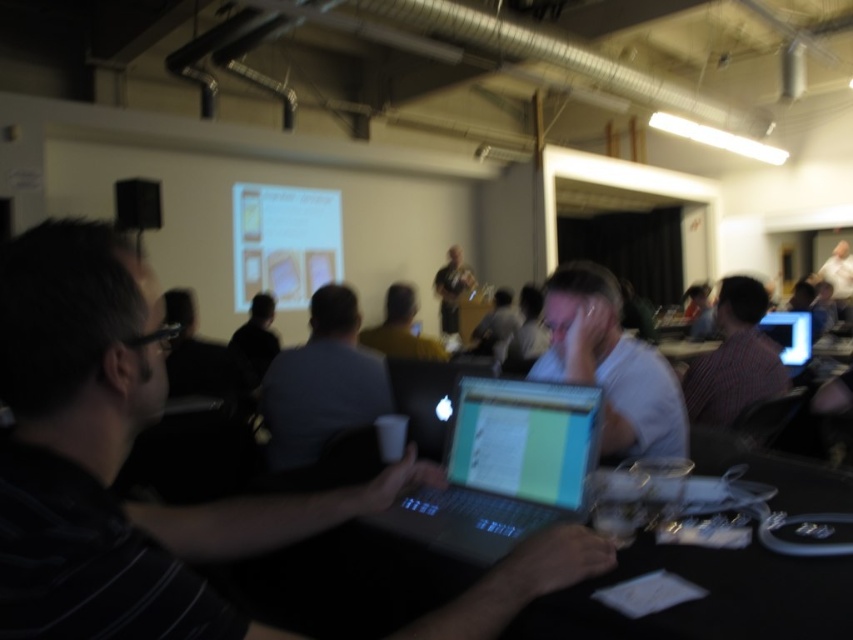
You are sitting at the table and want to see both the black matte speaker at upper left and the matte gray shirt at center. Which one is closer to you?

The black matte speaker at upper left is closer to you because it is further to the viewer than the matte gray shirt at center.

What is the 2D coordinate of the striped shirt at right in the image?

The striped shirt at right is located at the 2D coordinate point of (734,358).

You are an event organizer and need to arrange seating based on shirt colors. If you see the black matte shirt at center and the matte gray shirt at center, which one should you seat closer to the front to ensure visibility?

The black matte shirt at center should be seated closer to the front because it is shorter than the matte gray shirt at center, ensuring better visibility.